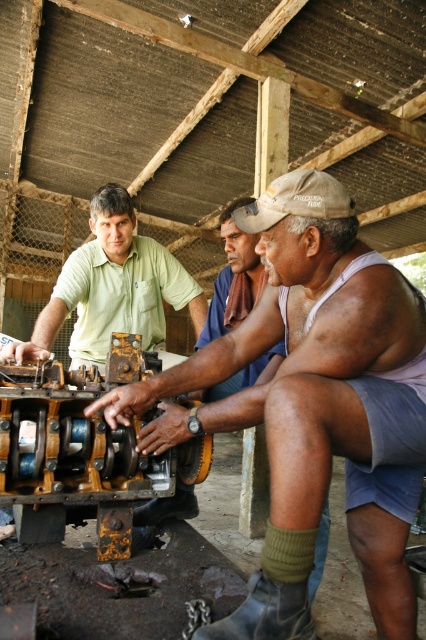
Question: Does matte black machine at center have a lesser width compared to green matte shirt at center?

Choices:
 (A) yes
 (B) no

Answer: (B)

Question: Which of the following is the closest to the observer?

Choices:
 (A) matte black machine at center
 (B) brown fabric shirt at center

Answer: (A)

Question: Can you confirm if matte black machine at center is thinner than green matte shirt at center?

Choices:
 (A) yes
 (B) no

Answer: (B)

Question: Which point is farther to the camera?

Choices:
 (A) matte black machine at center
 (B) brown fabric shirt at center

Answer: (B)

Question: Which point appears closest to the camera in this image?

Choices:
 (A) (138, 250)
 (B) (201, 333)

Answer: (B)

Question: Where is green matte shirt at center located in relation to brown fabric shirt at center in the image?

Choices:
 (A) below
 (B) above

Answer: (A)